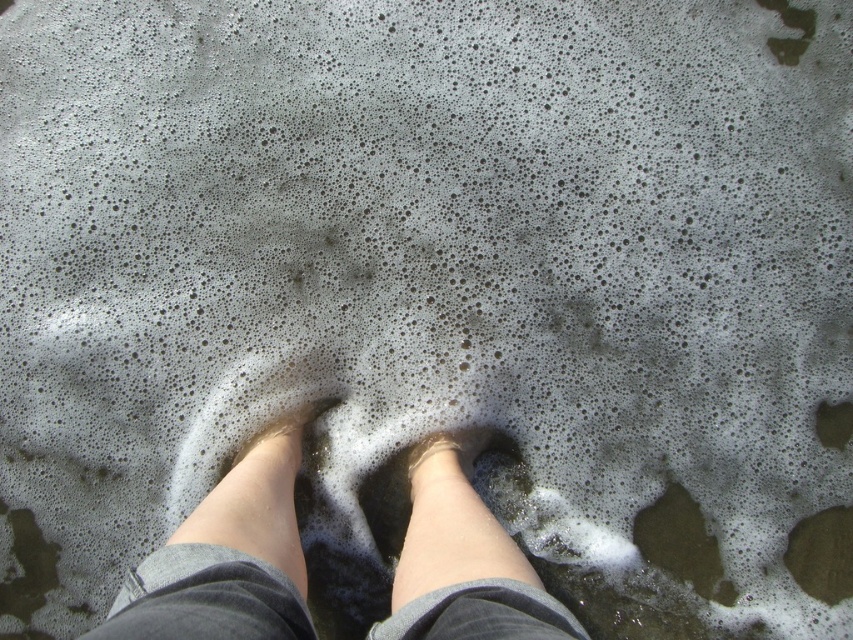
Based on the scene description, which object has a greater height between the smooth skin legs at center and the smooth tan skin at center?

The smooth skin legs at center has a greater height compared to the smooth tan skin at center.

Based on the scene description, which object is positioned higher up on the body between the smooth skin legs at center and the smooth tan skin at center?

The smooth skin legs at center is positioned higher up on the body than the smooth tan skin at center.

You are a photographer trying to capture the reflection of the smooth skin legs at center and the smooth tan skin at center in the foamy water. Which part of the legs will appear closer to the camera in the reflection?

The smooth skin legs at center will appear closer to the camera in the reflection because they are positioned in front of the smooth tan skin at center.